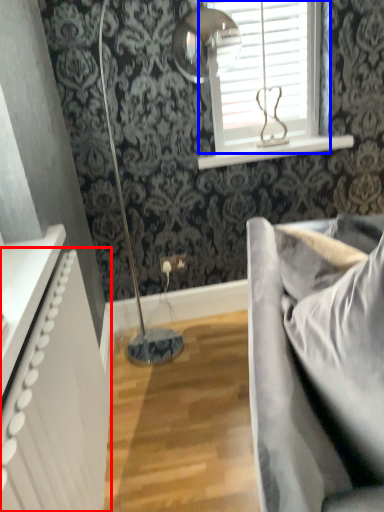
Question: Which object is closer to the camera taking this photo, radiator (highlighted by a red box) or window (highlighted by a blue box)?

Choices:
 (A) radiator
 (B) window

Answer: (A)